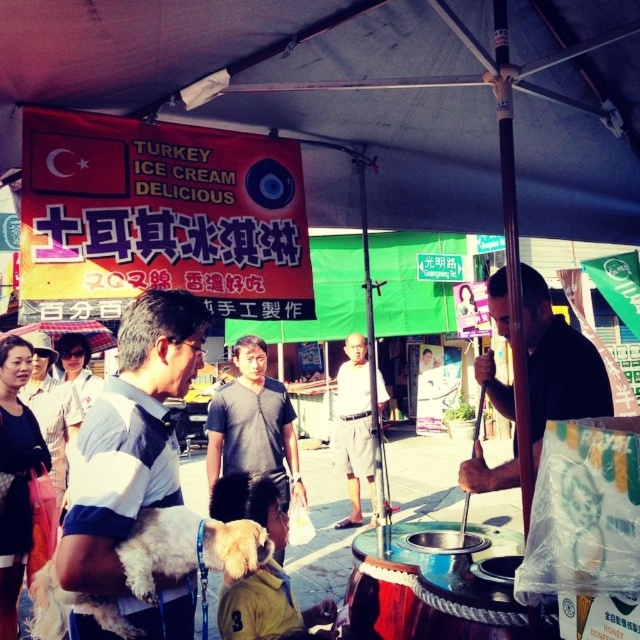
Does white soft dog at left come in front of transparent plastic umbrella at upper left?

Yes, white soft dog at left is in front of transparent plastic umbrella at upper left.

Who is shorter, white soft dog at left or transparent plastic umbrella at upper left?

transparent plastic umbrella at upper left

Find the location of a particular element. white soft dog at left is located at coordinates (132, 460).

Is light gray cotton shorts at center wider than transparent plastic umbrella at upper left?

In fact, light gray cotton shorts at center might be narrower than transparent plastic umbrella at upper left.

Is point (342, 372) less distant than point (52, 344)?

Yes, point (342, 372) is in front of point (52, 344).

Where is `light gray cotton shorts at center`? light gray cotton shorts at center is located at coordinates (355, 426).

Measure the distance from white soft dog at left to black fabric street vendor at center.

white soft dog at left and black fabric street vendor at center are 1.18 meters apart from each other.

Is white soft dog at left bigger than black fabric street vendor at center?

Incorrect, white soft dog at left is not larger than black fabric street vendor at center.

I want to click on white soft dog at left, so click(132, 460).

This screenshot has width=640, height=640. I want to click on white soft dog at left, so click(x=132, y=460).